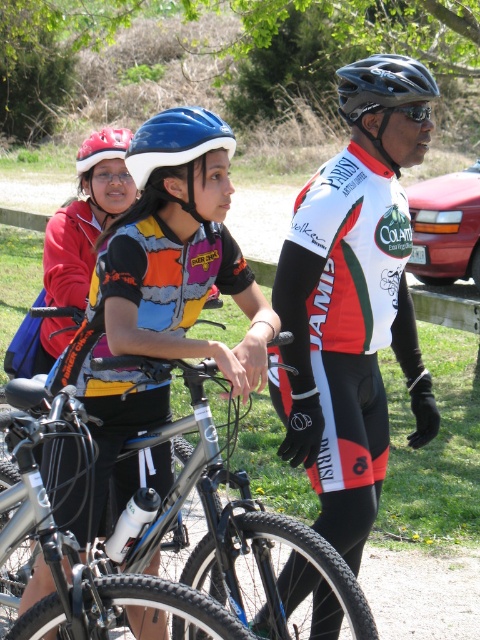
Is silver metallic bicycle at center above red matte helmet at upper left?

Actually, silver metallic bicycle at center is below red matte helmet at upper left.

Can you confirm if silver metallic bicycle at center is bigger than red matte helmet at upper left?

No, silver metallic bicycle at center is not bigger than red matte helmet at upper left.

You are a GUI agent. You are given a task and a screenshot of the screen. Output one action in this format:
    pyautogui.click(x=<x>, y=<y>)
    Task: Click on the silver metallic bicycle at center
    Image resolution: width=480 pixels, height=640 pixels.
    Given the screenshot: What is the action you would take?
    pyautogui.click(x=153, y=529)

This screenshot has height=640, width=480. Find the location of `silver metallic bicycle at center`. silver metallic bicycle at center is located at coordinates (153, 529).

Who is positioned more to the left, matte black helmet at center or shiny black helmet at center?

From the viewer's perspective, matte black helmet at center appears more on the left side.

Does matte black helmet at center appear on the right side of shiny black helmet at center?

In fact, matte black helmet at center is to the left of shiny black helmet at center.

Between point (169, 348) and point (346, 68), which one is positioned in front?

Positioned in front is point (169, 348).

Locate an element on the screen. This screenshot has height=640, width=480. matte black helmet at center is located at coordinates (164, 288).

Is the position of matte black helmet at center more distant than that of blue matte helmet at center?

No, matte black helmet at center is in front of blue matte helmet at center.

Does matte black helmet at center lie in front of blue matte helmet at center?

Yes, matte black helmet at center is closer to the viewer.

Is point (216, 349) behind point (141, 138)?

No, (216, 349) is in front of (141, 138).

Identify the location of matte black helmet at center. (164, 288).